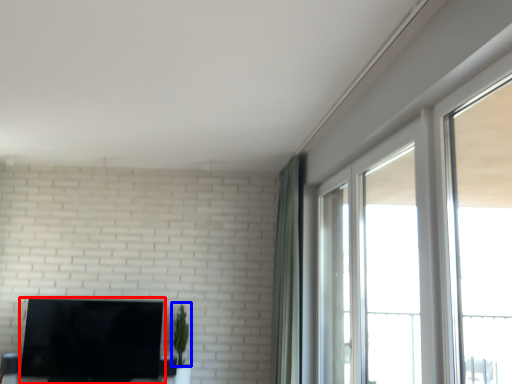
Question: Among these objects, which one is nearest to the camera, television (highlighted by a red box) or plant (highlighted by a blue box)?

Choices:
 (A) television
 (B) plant

Answer: (A)